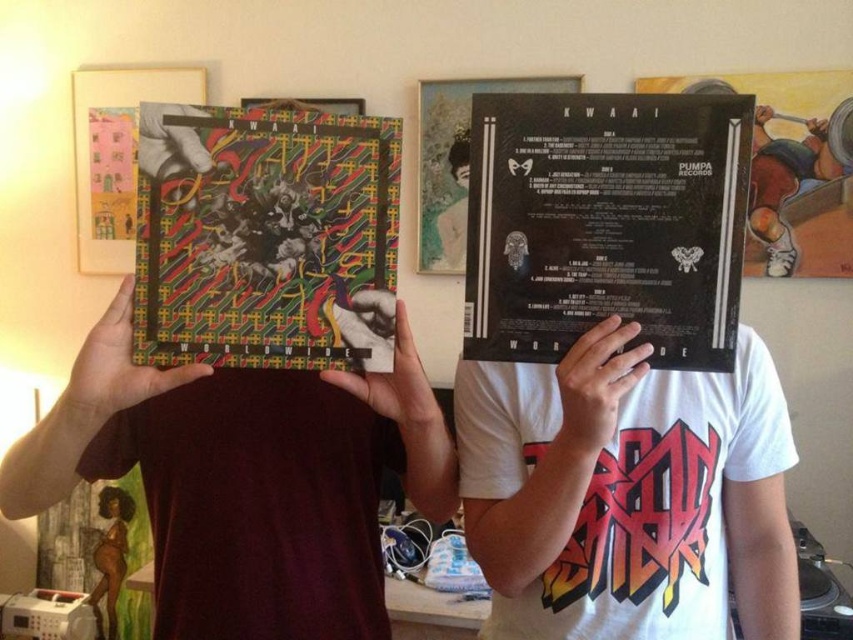
Looking at the scene described, which object is positioned to the right of the other between the black matte vinyl record at center and the matte black hair at center?

The black matte vinyl record at center is positioned to the right of the matte black hair at center.

You are standing in the room and want to determine which of the two points, point (341, 337) or point (468, 145), is nearer to you. Based on the scene, which one is closer?

Point (341, 337) is closer to the viewer than point (468, 145).